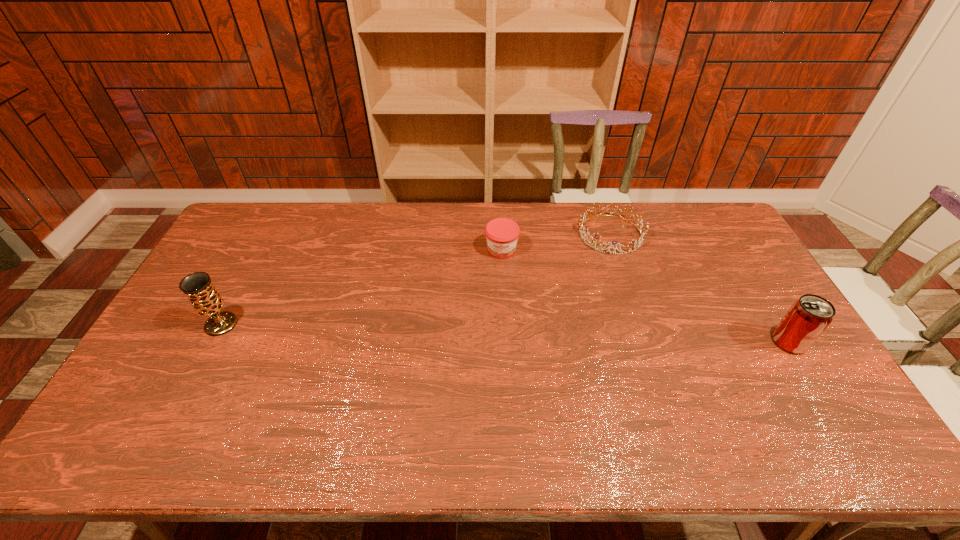
Locate an element on the screen. The image size is (960, 540). free space on the desktop that is between the leftmost object and the pop soda and is positioned on the label side of the jam is located at coordinates click(x=500, y=333).

This screenshot has width=960, height=540. In order to click on free space on the desktop that is between the chalice and the third shortest object and is positioned on the front-facing side of the tiara in this screenshot , I will do `click(511, 333)`.